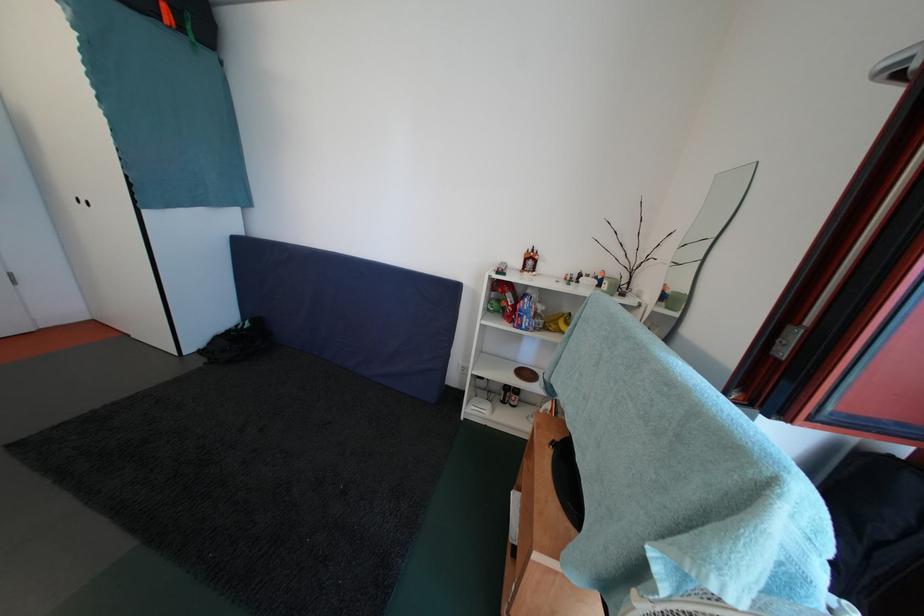
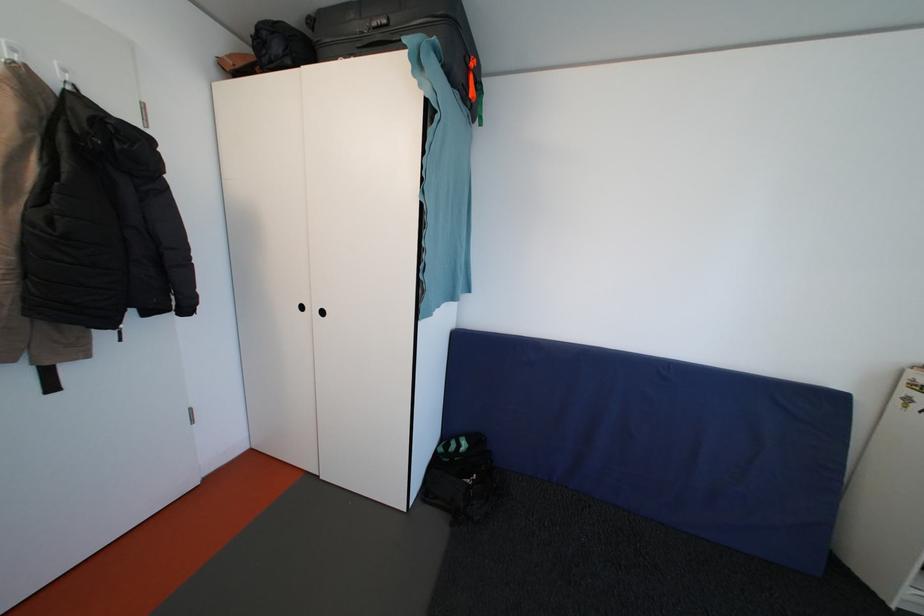
Question: The images are taken continuously from a first-person perspective. In which direction are you moving?

Choices:
 (A) Left
 (B) Right
 (C) Forward
 (D) Backward

Answer: (A)